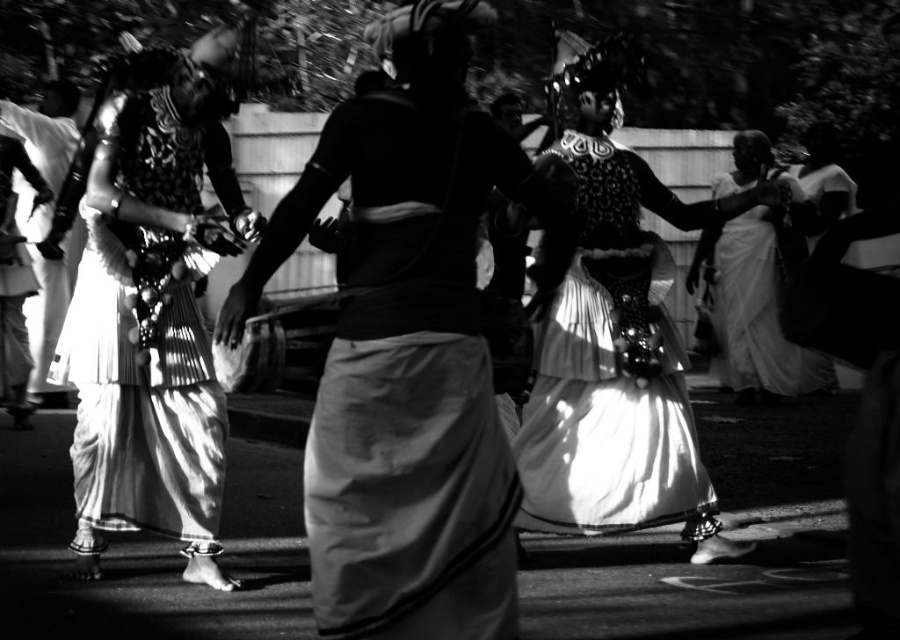
You are a photographer adjusting your camera to focus on two points in the image. The first point is point (696, 499) and the second is point (740, 224). Considering the scene described, which point should you focus on first if you want to capture the dancers in the foreground?

Point (696, 499) should be focused on first because it is in front of point (740, 224), making it closer to the camera and part of the foreground where the dancers are located.

Consider the image. You are a photographer who wants to capture a closeup of the white sheer fabric dress at left and the white silk dress at center. Since the dresses are in a crowded area, you need to know which one is smaller to frame your shot properly. Which dress should you focus on first to ensure it fits in the frame?

The white sheer fabric dress at left occupies less space than the white silk dress at center, so you should focus on the white sheer fabric dress at left first to ensure it fits in the frame before capturing the larger one.

In the black and white photograph of the dancers, you notice two items of clothing. The first is the white sheer fabric dress at left, and the second is the shiny white skirt at center. Which of these two items is positioned farther to the left?

The white sheer fabric dress at left is positioned farther to the left compared to the shiny white skirt at center.